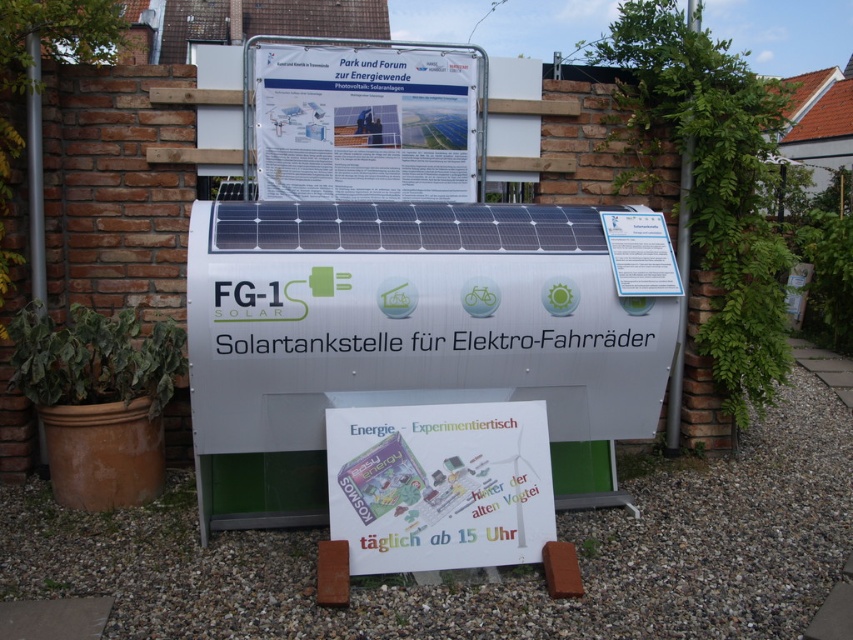
Between point (207, 432) and point (15, 376), which one is positioned behind?

Point (15, 376)

Does silver metallic solar battery at center have a greater height compared to green leafy plant at lower left?

Yes, silver metallic solar battery at center is taller than green leafy plant at lower left.

Find the location of `silver metallic solar battery at center`. silver metallic solar battery at center is located at coordinates (405, 339).

Is silver metallic solar battery at center positioned before green leafy plant at right?

Yes.

Is silver metallic solar battery at center further to the viewer compared to green leafy plant at right?

No, silver metallic solar battery at center is closer to the viewer.

Is point (206, 492) more distant than point (712, 108)?

No, (206, 492) is closer to viewer.

At what (x,y) coordinates should I click in order to perform the action: click on silver metallic solar battery at center. Please return your answer as a coordinate pair (x, y). This screenshot has width=853, height=640. Looking at the image, I should click on (405, 339).

Does green leafy plant at right have a lesser height compared to white paper sign at center?

No, green leafy plant at right is not shorter than white paper sign at center.

Between green leafy plant at right and white paper sign at center, which one is positioned higher?

Positioned higher is green leafy plant at right.

The width and height of the screenshot is (853, 640). I want to click on green leafy plant at right, so click(709, 180).